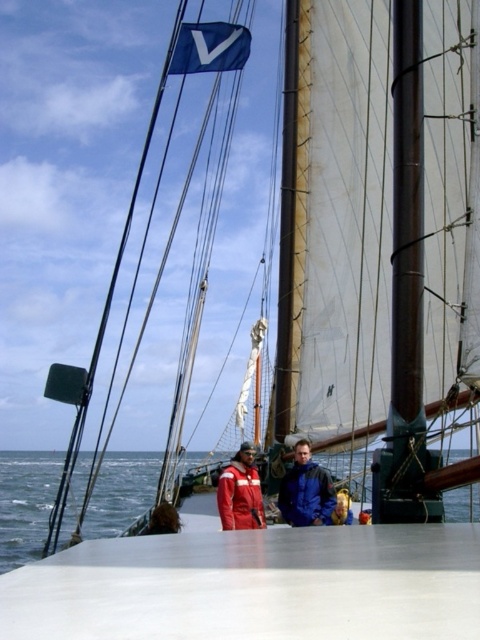
You are a sailor on the deck of the ship and you need to move from the golden hair at center to the blue water at lower left. Which direction should you go?

You should move to the left to reach the blue water at lower left from the golden hair at center because the blue water at lower left is to the left of golden hair at center.

You are a sailor on the deck of the ship and need to determine which object is taller between the blue matte jacket at center and the golden hair at center. Based on the scene, which one is taller?

The blue matte jacket at center is taller than golden hair at center.